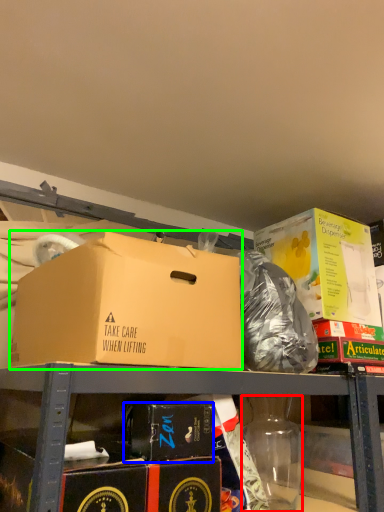
Question: Which object is positioned closest to bottle (highlighted by a red box)? Select from box (highlighted by a blue box) and box (highlighted by a green box).

Choices:
 (A) box
 (B) box

Answer: (A)